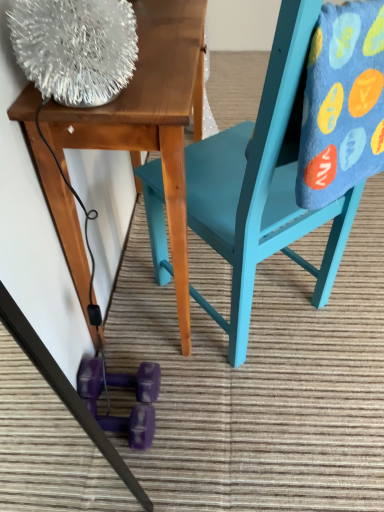
At what (x,y) coordinates should I click in order to perform the action: click on vacant space in between wooden table at upper left and purple rubber dumbbell at lower center. Please return your answer as a coordinate pair (x, y). Looking at the image, I should click on (162, 372).